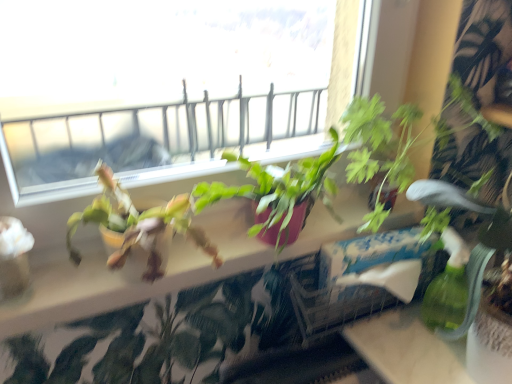
Question: From the image's perspective, relative to white cardboard box at center, is matte pink pot at center above or below?

Choices:
 (A) above
 (B) below

Answer: (A)

Question: In terms of height, does matte pink pot at center look taller or shorter compared to white cardboard box at center?

Choices:
 (A) tall
 (B) short

Answer: (B)

Question: Which of these objects is positioned farthest from the white cardboard box at center?

Choices:
 (A) matte pink pot at center
 (B) green leafy plant at right

Answer: (B)

Question: Considering the real-world distances, which object is closest to the matte pink pot at center?

Choices:
 (A) green leafy plant at right
 (B) white cardboard box at center

Answer: (B)